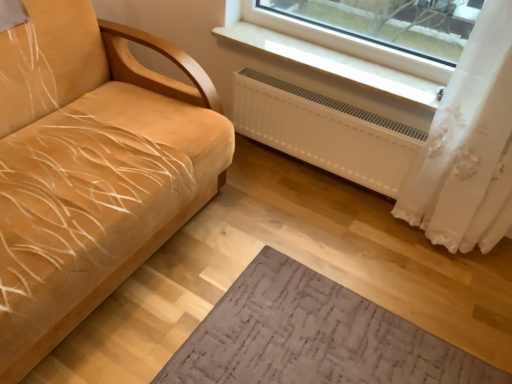
Question: Can you confirm if white matte radiator at lower center is smaller than white sheer curtain at right?

Choices:
 (A) yes
 (B) no

Answer: (A)

Question: Does white matte radiator at lower center have a lesser height compared to white sheer curtain at right?

Choices:
 (A) no
 (B) yes

Answer: (B)

Question: Does white matte radiator at lower center appear on the right side of white sheer curtain at right?

Choices:
 (A) no
 (B) yes

Answer: (A)

Question: Is white matte radiator at lower center positioned beyond the bounds of white sheer curtain at right?

Choices:
 (A) no
 (B) yes

Answer: (B)

Question: Is white matte radiator at lower center to the left of white sheer curtain at right from the viewer's perspective?

Choices:
 (A) no
 (B) yes

Answer: (B)

Question: Can you confirm if white matte radiator at lower center is thinner than white sheer curtain at right?

Choices:
 (A) no
 (B) yes

Answer: (B)

Question: Can you confirm if velvet yellow couch at left is shorter than white sheer curtain at right?

Choices:
 (A) no
 (B) yes

Answer: (A)

Question: Is velvet yellow couch at left surrounding white sheer curtain at right?

Choices:
 (A) yes
 (B) no

Answer: (B)

Question: Are velvet yellow couch at left and white sheer curtain at right making contact?

Choices:
 (A) no
 (B) yes

Answer: (A)

Question: Is velvet yellow couch at left outside white sheer curtain at right?

Choices:
 (A) yes
 (B) no

Answer: (A)

Question: Would you consider velvet yellow couch at left to be distant from white sheer curtain at right?

Choices:
 (A) yes
 (B) no

Answer: (A)

Question: From a real-world perspective, is velvet yellow couch at left positioned under white sheer curtain at right based on gravity?

Choices:
 (A) no
 (B) yes

Answer: (B)

Question: Is white matte radiator at lower center facing towards white plastic radiator at upper center?

Choices:
 (A) no
 (B) yes

Answer: (A)